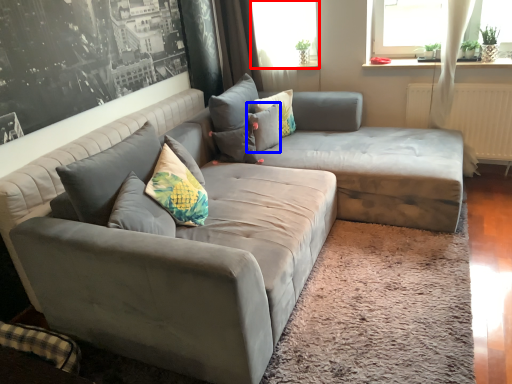
Question: Which point is further to the camera, window screen (highlighted by a red box) or pillow (highlighted by a blue box)?

Choices:
 (A) window screen
 (B) pillow

Answer: (A)